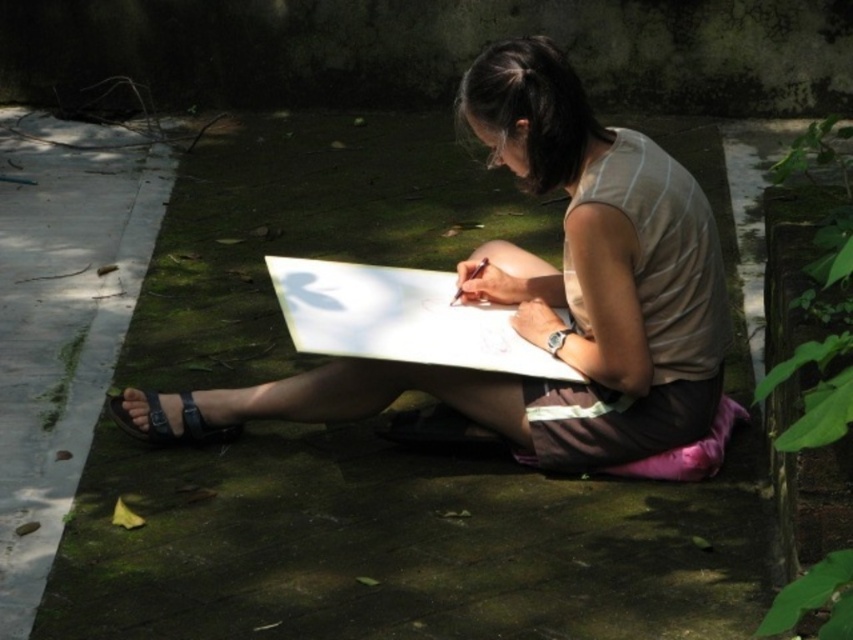
You are a drone operator trying to capture a photo of the person drawing. The drone is currently positioned above the point labeled as point (556,292). To get the best shot of the person, should you move the drone north or south relative to the point?

The point 0.453 represents the matte white paper at center. Since the paper is at the center, moving the drone north would position it closer to the top of the image, while moving south would bring it closer to the bottom. To capture the person drawing, moving north would ensure the drone is above the paper and centered on the person.

You are a photographer trying to capture the scene from above. The matte white paper at center and the black leather sandal at lower left are in your frame. Which object will appear taller in the photo?

The matte white paper at center will appear taller in the photo because it is taller than the black leather sandal at lower left according to the description.

You are an artist who wants to draw a detailed landscape on the matte white paper at center. Considering the size of the black leather sandal at lower left, will the paper be large enough to accommodate a drawing twice the size of the sandal?

The matte white paper at center is wider than the black leather sandal at lower left, so it can accommodate a drawing twice the size of the sandal since the paper is larger in width.